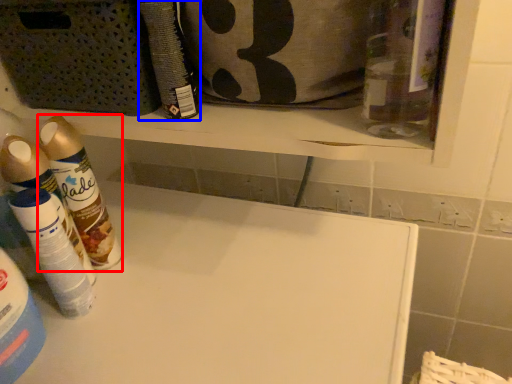
Question: Among these objects, which one is farthest to the camera, cleaning product (highlighted by a red box) or cleaning product (highlighted by a blue box)?

Choices:
 (A) cleaning product
 (B) cleaning product

Answer: (A)